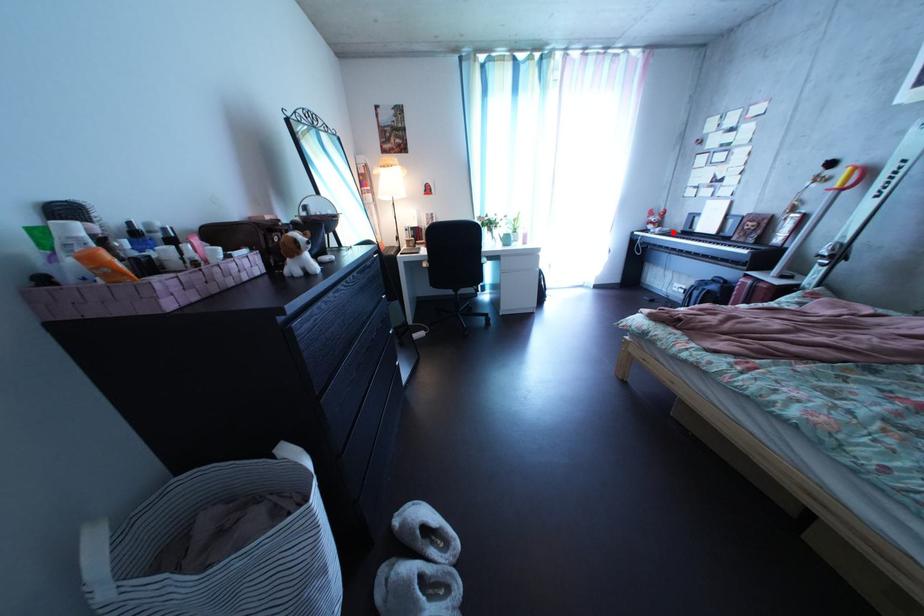
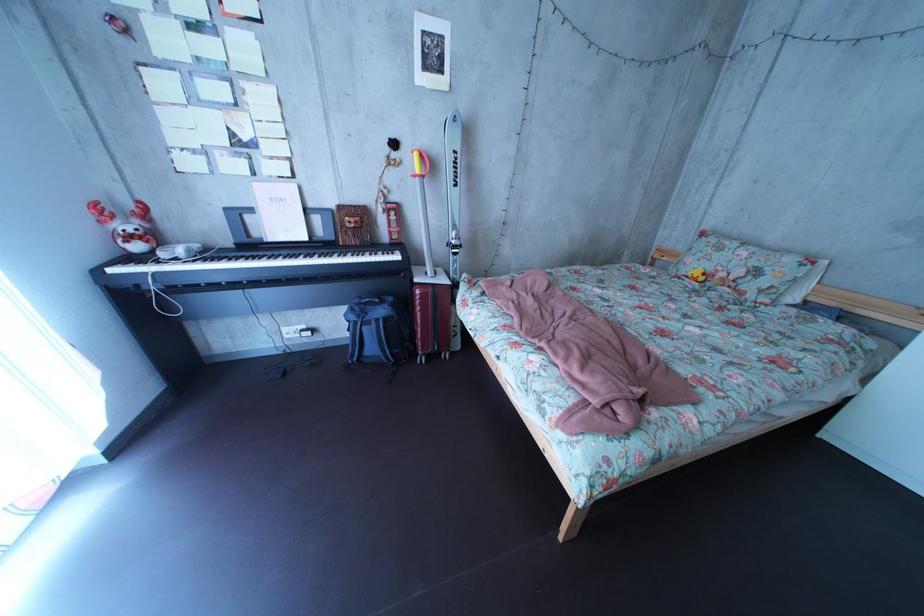
Question: I am providing you with two images of the same scene from different viewpoints. Image1 has a red point marked. In image2, the corresponding 3D location appears at what relative position? Reply with the corresponding letter.

Choices:
 (A) Closer
 (B) Farther

Answer: (B)